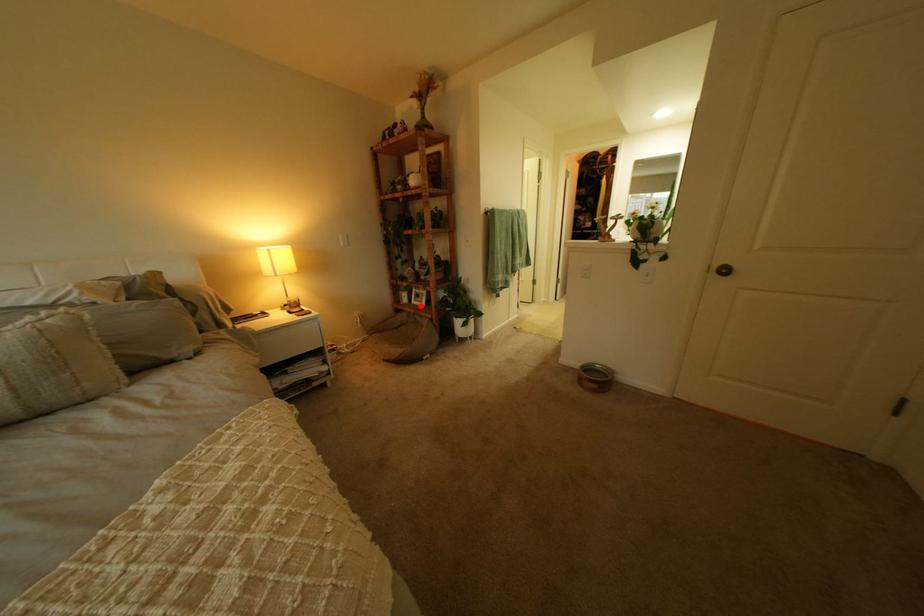
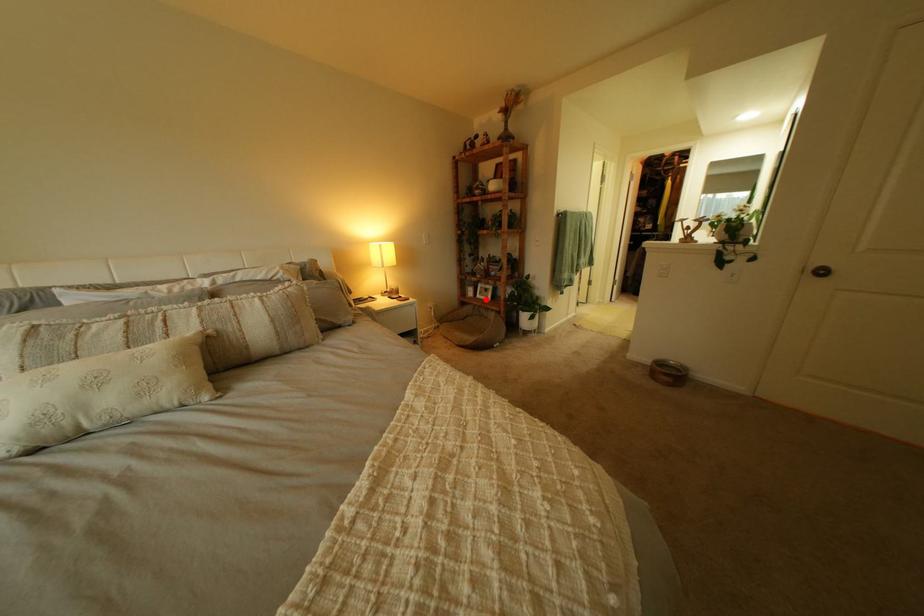
I am providing you with two images of the same scene from different viewpoints. A red point is marked on the first image and another point is marked on the second image. Are the points marked in image1 and image2 representing the same 3D position?

Yes